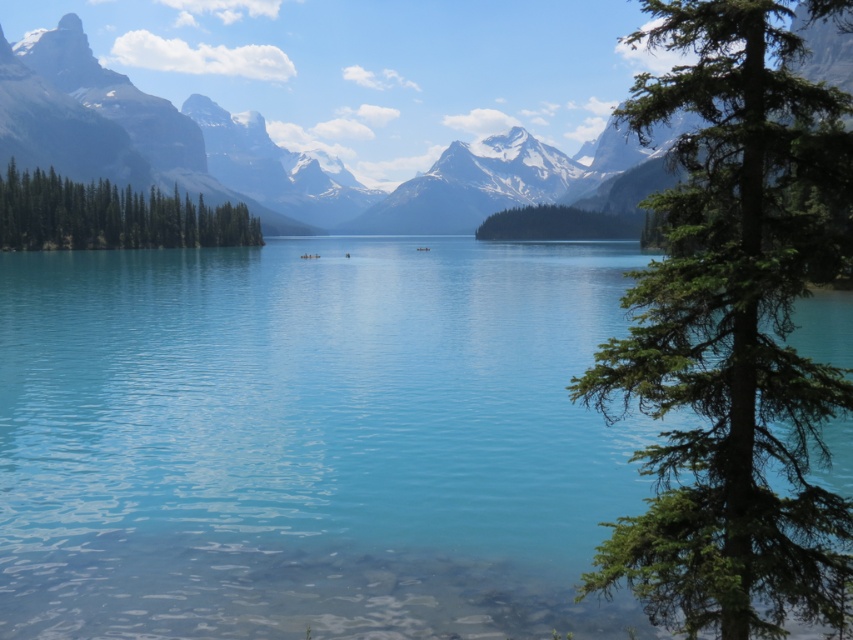
You are standing at the point marked by point [405,180] in the image. What is the closest object to you in the scene?

The smooth granite mountain at center is represented by point [405,180], so you are already at the location of the smooth granite mountain at center.

You are a hiker standing at the edge of the lake and looking towards the mountains. Which object, the clear blue water at center or the smooth granite mountain at center, is located higher in the scene?

The smooth granite mountain at center is higher than the clear blue water at center because the description states that the clear blue water at center is below the smooth granite mountain at center.